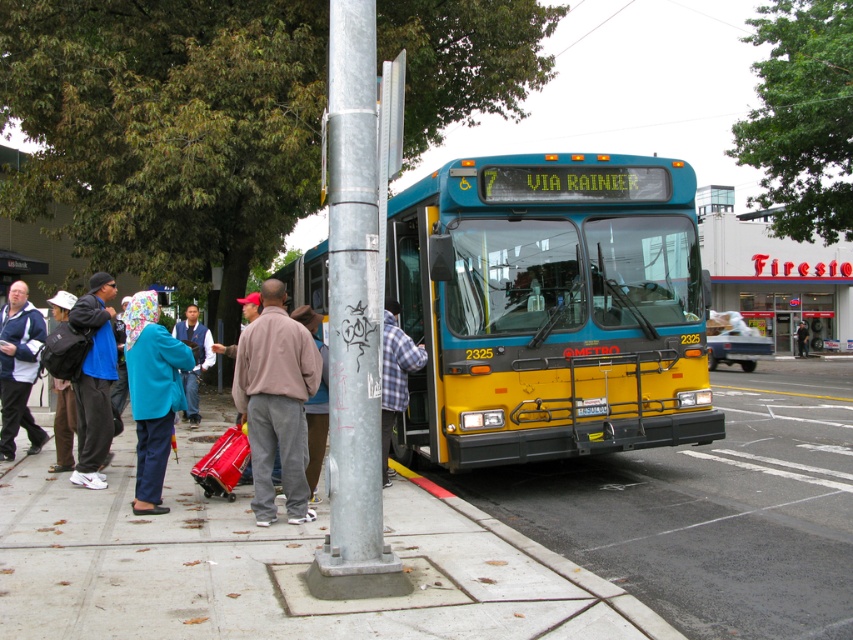
Question: Does blue/yellow metal bus at center lie in front of blue fleece jacket at left?

Choices:
 (A) yes
 (B) no

Answer: (B)

Question: Among these objects, which one is nearest to the camera?

Choices:
 (A) blue fleece jacket at center
 (B) blue fabric jacket at left

Answer: (A)

Question: Does blue/yellow metal bus at center have a smaller size compared to brown fleece jacket at center?

Choices:
 (A) yes
 (B) no

Answer: (B)

Question: Which object is closer to the camera taking this photo?

Choices:
 (A) blue fabric jacket at left
 (B) brown fleece jacket at center

Answer: (B)

Question: Estimate the real-world distances between objects in this image. Which object is farther from the concrete at center?

Choices:
 (A) light brown leather jacket at center
 (B) brown fleece jacket at center
 (C) blue/yellow metal bus at center
 (D) blue fabric jacket at center

Answer: (A)

Question: Does galvanized metal pole at center have a greater width compared to blue fleece jacket at center?

Choices:
 (A) no
 (B) yes

Answer: (A)